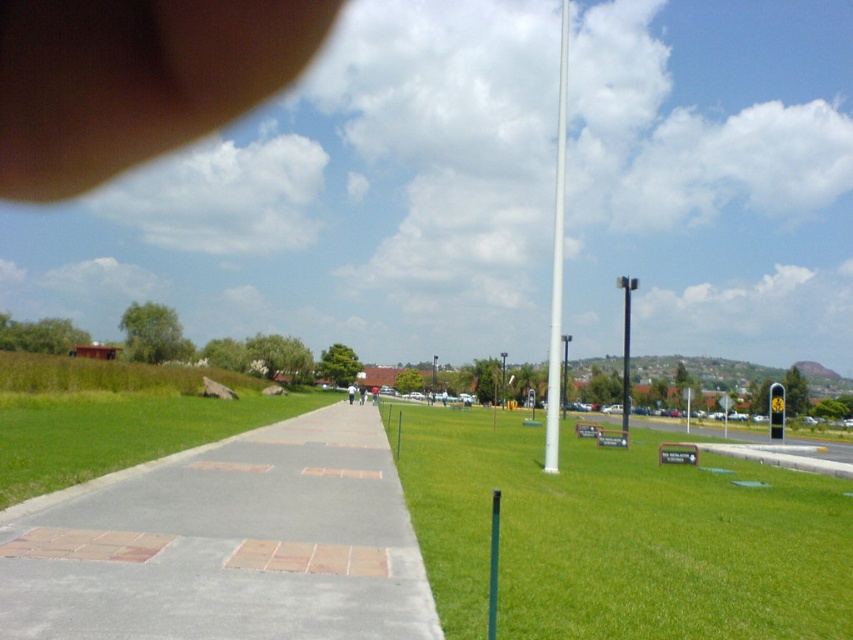
Does green grass at center have a smaller size compared to white glossy pole at center?

Yes, green grass at center is smaller than white glossy pole at center.

Between green grass at center and white glossy pole at center, which one appears on the left side from the viewer's perspective?

Positioned to the left is green grass at center.

This screenshot has height=640, width=853. In order to click on green grass at center in this screenshot , I will do `click(619, 536)`.

Identify the location of green grass at center. The image size is (853, 640). (619, 536).

Measure the distance between gray concrete sidewalk at lower left and white glossy pole at center.

gray concrete sidewalk at lower left and white glossy pole at center are 29.65 meters apart from each other.

Can you confirm if gray concrete sidewalk at lower left is taller than white glossy pole at center?

In fact, gray concrete sidewalk at lower left may be shorter than white glossy pole at center.

The image size is (853, 640). Find the location of `gray concrete sidewalk at lower left`. gray concrete sidewalk at lower left is located at coordinates (225, 544).

From the picture: Can you confirm if green grass at center is shorter than gray concrete sidewalk at lower left?

No.

Who is more forward, (422, 477) or (248, 525)?

Positioned in front is point (248, 525).

Who is more forward, (482, 620) or (231, 566)?

Positioned in front is point (482, 620).

This screenshot has width=853, height=640. I want to click on green grass at center, so click(619, 536).